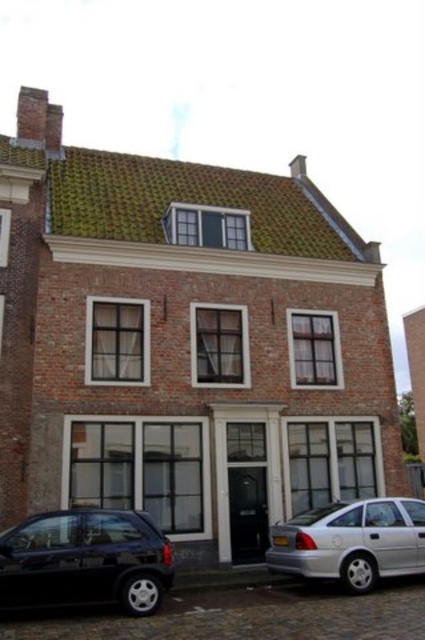
Based on the photo, can you confirm if shiny black car at lower left is positioned to the left of silver metallic sedan at lower right?

Indeed, shiny black car at lower left is positioned on the left side of silver metallic sedan at lower right.

This screenshot has height=640, width=425. Describe the element at coordinates (85, 561) in the screenshot. I see `shiny black car at lower left` at that location.

The height and width of the screenshot is (640, 425). Find the location of `shiny black car at lower left`. shiny black car at lower left is located at coordinates (85, 561).